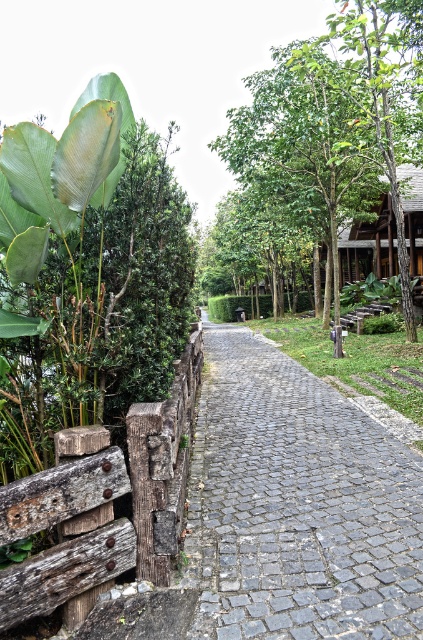
You are standing at the start of the gray cobblestone pavement at center. You want to walk to a bench located 10 feet ahead along the path. Can you reach the bench without stepping off the pavement?

The gray cobblestone pavement at center is 8.20 feet away from you. Since the bench is 10 feet ahead, you can reach it by walking forward along the pavement as the distance is within the available path length.

You are planning to take a photo of the wooden park bench at center from the green leafy tree at upper center. Which side of the bench should you position yourself to capture the entire bench in the frame?

Since the green leafy tree at upper center is to the left of the wooden park bench at center, you should position yourself to the left side of the bench to capture the entire bench in the frame.